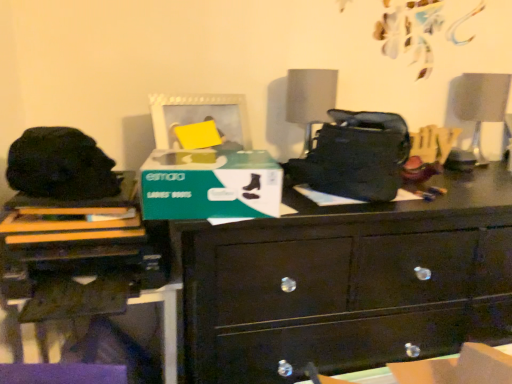
Locate an element on the screen. This screenshot has height=384, width=512. black wood chest of drawers at center is located at coordinates (348, 283).

The height and width of the screenshot is (384, 512). What do you see at coordinates (210, 185) in the screenshot?
I see `green matte cardboard box at center` at bounding box center [210, 185].

This screenshot has width=512, height=384. Describe the element at coordinates (337, 345) in the screenshot. I see `glossy dark wood drawer at lower center` at that location.

The width and height of the screenshot is (512, 384). Find the location of `black wood chest of drawers at center`. black wood chest of drawers at center is located at coordinates (348, 283).

Consider the image. Which is further, [236,127] or [455,326]?

The point [236,127] is farther.

Is glossy dark wood drawer at lower center completely or partially inside white matte picture frame at upper center?

That's incorrect, glossy dark wood drawer at lower center is not inside white matte picture frame at upper center.

Is white matte picture frame at upper center in front of or behind glossy dark wood drawer at lower center in the image?

In the image, white matte picture frame at upper center appears behind glossy dark wood drawer at lower center.

Considering the relative positions of glossy dark wood drawer at lower center and white matte picture frame at upper center in the image provided, is glossy dark wood drawer at lower center to the left or to the right of white matte picture frame at upper center?

From the image, it's evident that glossy dark wood drawer at lower center is to the right of white matte picture frame at upper center.

Which is nearer, (372, 320) or (164, 126)?

Positioned in front is point (372, 320).

Is glossy dark wood drawer at lower center placed right next to white matte picture frame at upper center?

glossy dark wood drawer at lower center and white matte picture frame at upper center are clearly separated.

From a real-world perspective, who is located lower, glossy dark wood drawer at lower center or white matte picture frame at upper center?

In real-world perspective, glossy dark wood drawer at lower center is lower.

Based on the photo, is matte gray lampshade at center in contact with green matte cardboard box at center?

matte gray lampshade at center and green matte cardboard box at center are clearly separated.

Considering the positions of point (298, 94) and point (210, 207), is point (298, 94) closer or farther from the camera than point (210, 207)?

Point (298, 94) appears to be farther away from the viewer than point (210, 207).

From a real-world perspective, which is physically above, matte gray lampshade at center or green matte cardboard box at center?

matte gray lampshade at center is physically above.

Consider the image. What's the angular difference between matte gray lampshade at center and green matte cardboard box at center's facing directions?

The angle between the facing direction of matte gray lampshade at center and the facing direction of green matte cardboard box at center is 10.1 degrees.

In terms of width, does green matte cardboard box at center look wider or thinner when compared to matte gray lampshade at center?

Clearly, green matte cardboard box at center has more width compared to matte gray lampshade at center.

Can you confirm if green matte cardboard box at center is taller than matte gray lampshade at center?

Answer: In fact, green matte cardboard box at center may be shorter than matte gray lampshade at center.

Is green matte cardboard box at center facing towards matte gray lampshade at center?

No, green matte cardboard box at center is not turned towards matte gray lampshade at center.

Is white matte picture frame at upper center completely or partially outside of green matte cardboard box at center?

Indeed, white matte picture frame at upper center is completely outside green matte cardboard box at center.

Based on the photo, what's the angular difference between white matte picture frame at upper center and green matte cardboard box at center's facing directions?

The angle between the facing direction of white matte picture frame at upper center and the facing direction of green matte cardboard box at center is 26.5 degrees.

From a real-world perspective, which is physically below, white matte picture frame at upper center or green matte cardboard box at center?

From a 3D spatial view, green matte cardboard box at center is below.

What are the coordinates of `cardboard box in front of the white matte picture frame at upper center` in the screenshot? It's located at (210, 185).

Are green matte cardboard box at center and glossy dark wood drawer at lower center making contact?

No, green matte cardboard box at center is not in contact with glossy dark wood drawer at lower center.

Which object is more forward, green matte cardboard box at center or glossy dark wood drawer at lower center?

Positioned in front is glossy dark wood drawer at lower center.

Can you confirm if green matte cardboard box at center is positioned to the right of glossy dark wood drawer at lower center?

No.

Based on the photo, how much distance is there between matte black printer at lower left and white matte picture frame at upper center?

40.42 centimeters.

Is matte black printer at lower left not inside white matte picture frame at upper center?

Yes, matte black printer at lower left is not within white matte picture frame at upper center.

Does point (14, 238) come closer to viewer compared to point (232, 137)?

Yes, it is in front of point (232, 137).

This screenshot has height=384, width=512. I want to click on drawer located underneath the white matte picture frame at upper center (from a real-world perspective), so click(337, 345).

In order to click on picture frame that appears on the left of glossy dark wood drawer at lower center in this screenshot , I will do `click(199, 115)`.

From the image, which object appears to be farther from white matte picture frame at upper center, matte gray lampshade at center or black wood chest of drawers at center?

black wood chest of drawers at center.

When comparing their distances from matte gray lampshade at center, does black wood chest of drawers at center or matte black printer at lower left seem further?

The object further to matte gray lampshade at center is matte black printer at lower left.

Looking at the image, which one is located closer to glossy dark wood drawer at lower center, matte gray lampshade at center or white matte picture frame at upper center?

Among the two, matte gray lampshade at center is located nearer to glossy dark wood drawer at lower center.

Estimate the real-world distances between objects in this image. Which object is closer to white matte picture frame at upper center, black wood chest of drawers at center or matte gray lampshade at center?

The object closer to white matte picture frame at upper center is matte gray lampshade at center.

Estimate the real-world distances between objects in this image. Which object is closer to glossy dark wood drawer at lower center, white glossy swivel chair at upper right or black wood chest of drawers at center?

black wood chest of drawers at center is closer to glossy dark wood drawer at lower center.

Estimate the real-world distances between objects in this image. Which object is further from white glossy swivel chair at upper right, green matte cardboard box at center or matte black printer at lower left?

matte black printer at lower left is further to white glossy swivel chair at upper right.

Considering their positions, is matte black printer at lower left positioned further to glossy dark wood drawer at lower center than green matte cardboard box at center?

matte black printer at lower left lies further to glossy dark wood drawer at lower center than the other object.

From the image, which object appears to be farther from glossy dark wood drawer at lower center, matte gray lampshade at center or white glossy swivel chair at upper right?

white glossy swivel chair at upper right lies further to glossy dark wood drawer at lower center than the other object.

The width and height of the screenshot is (512, 384). Identify the location of chest of drawers between matte gray lampshade at center and glossy dark wood drawer at lower center from top to bottom. (348, 283).

Locate an element on the screen. table lamp between matte black printer at lower left and glossy dark wood drawer at lower center in the horizontal direction is located at coordinates (310, 99).

Locate an element on the screen. cardboard box between white matte picture frame at upper center and white glossy swivel chair at upper right is located at coordinates (210, 185).

Where is `table lamp between white glossy swivel chair at upper right and black wood chest of drawers at center in the vertical direction`? The image size is (512, 384). table lamp between white glossy swivel chair at upper right and black wood chest of drawers at center in the vertical direction is located at coordinates coord(310,99).